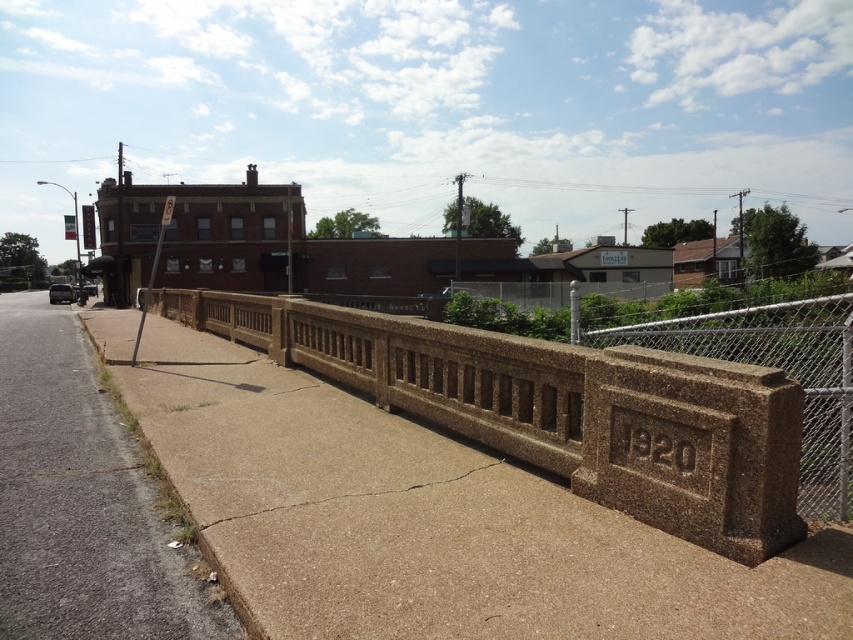
Question: Can you confirm if brown textured concrete at center is positioned below gray concrete sidewalk at lower left?

Choices:
 (A) no
 (B) yes

Answer: (A)

Question: Does brown textured concrete at center have a larger size compared to gray concrete sidewalk at lower left?

Choices:
 (A) no
 (B) yes

Answer: (A)

Question: Which object is closer to the camera taking this photo?

Choices:
 (A) gray concrete sidewalk at lower left
 (B) brown textured concrete at center

Answer: (A)

Question: Which object is farther from the camera taking this photo?

Choices:
 (A) gray concrete sidewalk at lower left
 (B) brown textured concrete at center

Answer: (B)

Question: Observing the image, what is the correct spatial positioning of brown textured concrete at center in reference to gray concrete sidewalk at lower left?

Choices:
 (A) left
 (B) right

Answer: (B)

Question: Which point appears farthest from the camera in this image?

Choices:
 (A) (119, 547)
 (B) (705, 392)

Answer: (A)